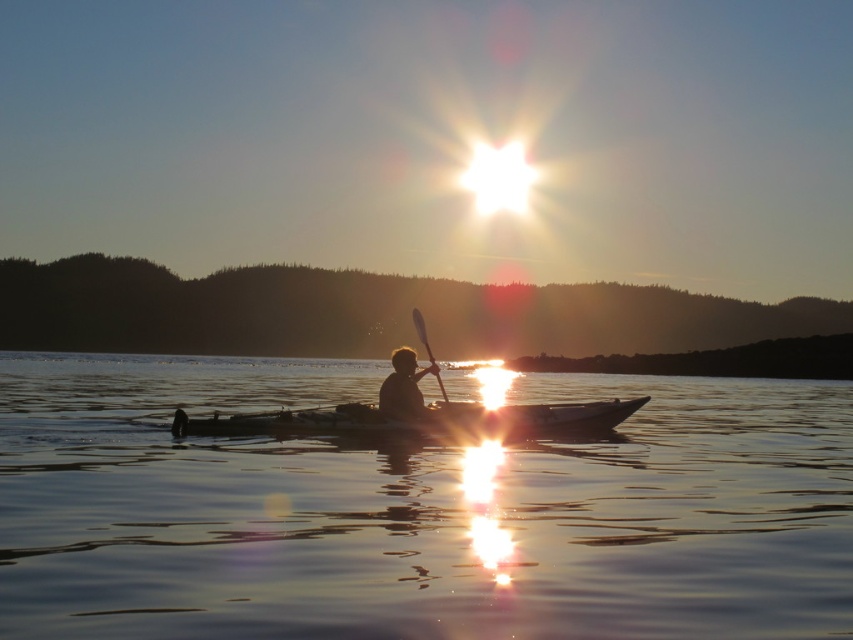
You are a photographer trying to capture the silhouette of the person kayaking against the sunset. You notice a point marked at coordinates (404, 387). Based on the scene description, where is this point located in relation to the kayaker?

The point at (404, 387) marks the smooth skin of the person at the center, indicating it is located on the kayaker themselves.